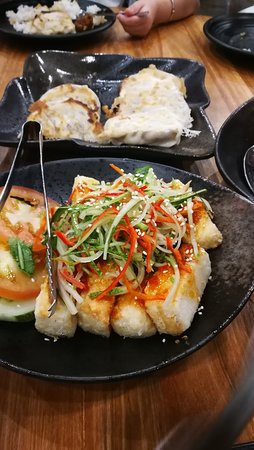
I want to click on plate, so click(x=118, y=375).